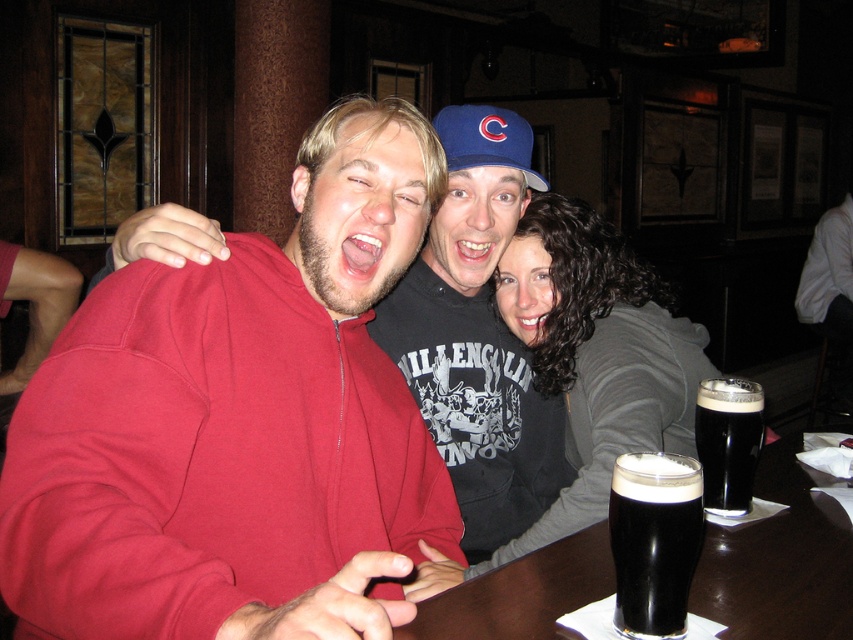
Does dark wood table at center appear under black matte stout at center?

Yes.

Describe the element at coordinates (779, 561) in the screenshot. I see `dark wood table at center` at that location.

This screenshot has width=853, height=640. Find the location of `dark wood table at center`. dark wood table at center is located at coordinates point(779,561).

Does matte red hoodie at center have a greater height compared to black matte stout at center?

Correct, matte red hoodie at center is much taller as black matte stout at center.

Between point (126, 560) and point (683, 548), which one is positioned behind?

The point (683, 548) is behind.

Which is in front, point (328, 125) or point (648, 614)?

Positioned in front is point (648, 614).

The image size is (853, 640). I want to click on matte red hoodie at center, so click(238, 424).

What do you see at coordinates (596, 355) in the screenshot?
I see `smooth dark hair at center` at bounding box center [596, 355].

Does smooth dark hair at center have a lesser width compared to dark wood table at center?

Yes, smooth dark hair at center is thinner than dark wood table at center.

Identify the location of smooth dark hair at center. Image resolution: width=853 pixels, height=640 pixels. (596, 355).